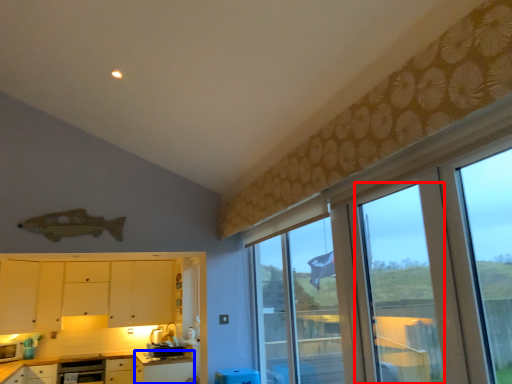
Question: Which object is closer to the camera taking this photo, screen door (highlighted by a red box) or table (highlighted by a blue box)?

Choices:
 (A) screen door
 (B) table

Answer: (A)